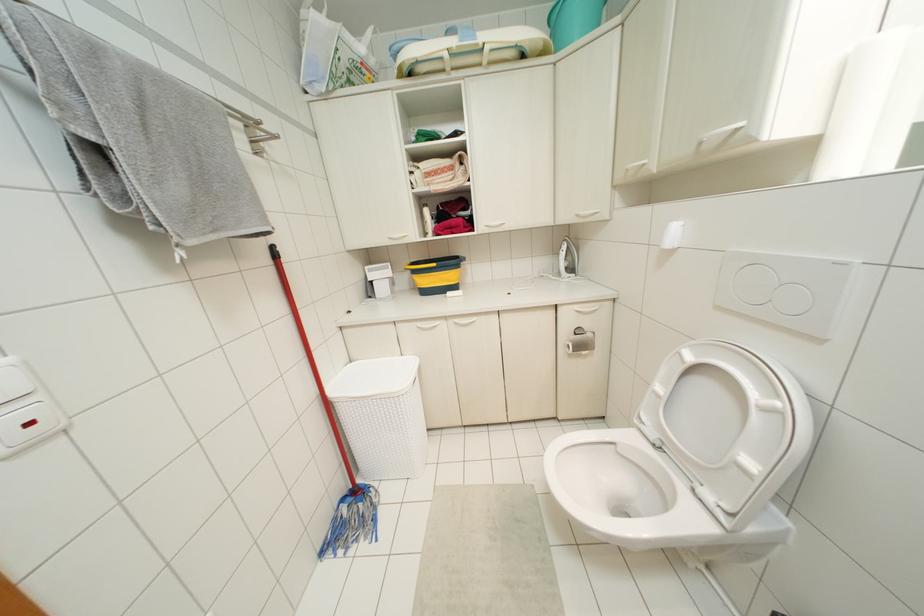
At what (x,y) coordinates should I click in order to perform the action: click on small ironing board. Please return your answer as a coordinate pair (x, y). The width and height of the screenshot is (924, 616). Looking at the image, I should click on (485, 554).